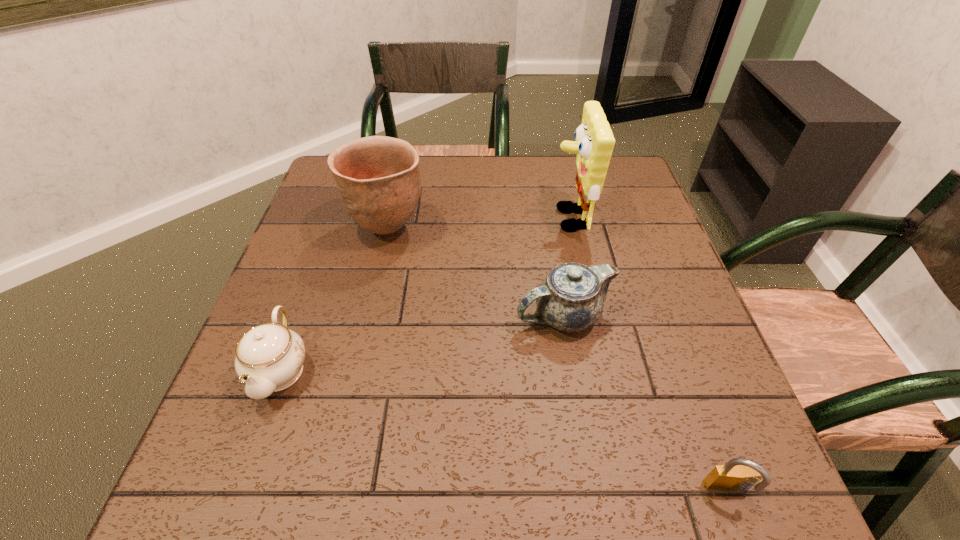
Locate an element on the screen. free spot between the fourth shortest object and the left chinaware is located at coordinates (334, 299).

Locate an element on the screen. blank region between the padlock and the left chinaware is located at coordinates (504, 430).

Where is `free space between the tallest object and the nearest object`? free space between the tallest object and the nearest object is located at coordinates (648, 355).

You are a GUI agent. You are given a task and a screenshot of the screen. Output one action in this format:
    pyautogui.click(x=<x>, y=<y>)
    Task: Click on the second closest object relative to the pottery
    The height and width of the screenshot is (540, 960).
    Given the screenshot: What is the action you would take?
    pyautogui.click(x=571, y=298)

The image size is (960, 540). In order to click on object that is the third closest one to the nearest object in this screenshot , I will do `click(269, 357)`.

At what (x,y) coordinates should I click in order to perform the action: click on free space that satisfies the following two spatial constraints: 1. from the spout of the right chinaware; 2. at the spout of the left chinaware. Please return your answer as a coordinate pair (x, y). The image size is (960, 540). Looking at the image, I should click on (573, 370).

Find the location of a particular element. free space that satisfies the following two spatial constraints: 1. on the face of the sponge; 2. at the spout of the left chinaware is located at coordinates (602, 370).